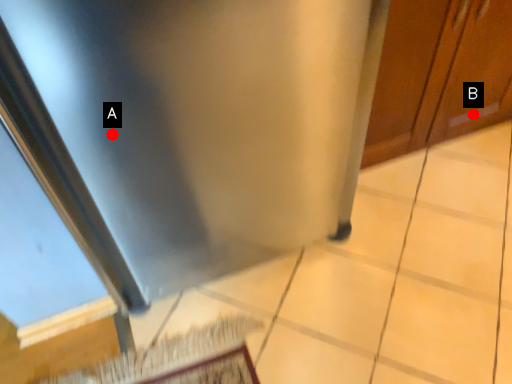
Question: Two points are circled on the image, labeled by A and B beside each circle. Which of the following is the farthest from the observer?

Choices:
 (A) A is further
 (B) B is further

Answer: (B)